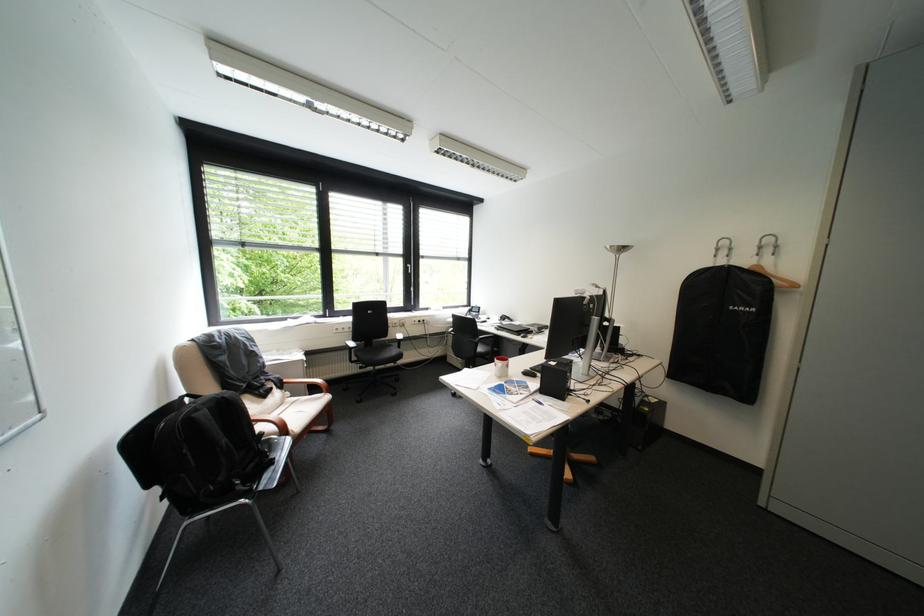
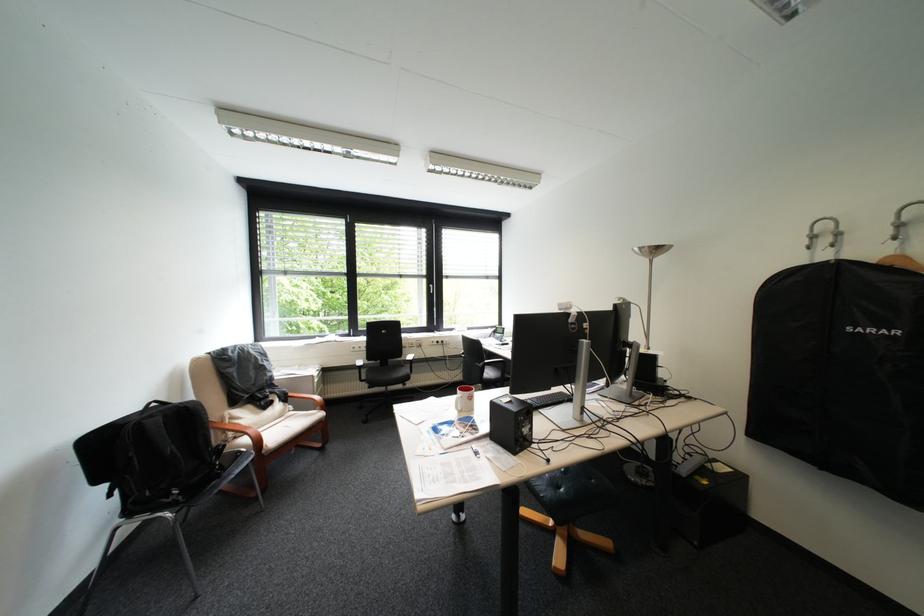
Locate, in the second image, the point that corresponds to [273,368] in the first image.

(280, 381)